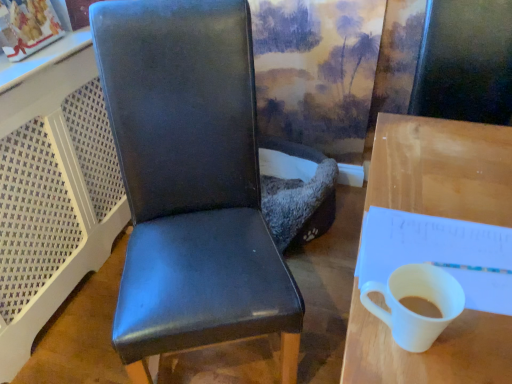
Locate an element on the screen. This screenshot has height=384, width=512. unoccupied space behind white paper notepad at right is located at coordinates (434, 185).